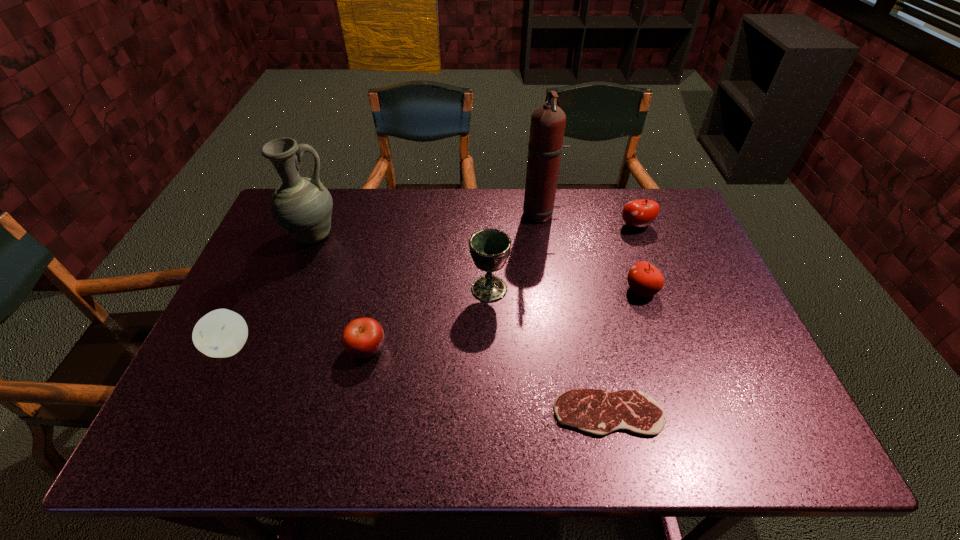
Where is `free point located 0.170m on the side of the tallest object with the label and nozzle`? This screenshot has width=960, height=540. free point located 0.170m on the side of the tallest object with the label and nozzle is located at coordinates (471, 215).

Find the location of `vacant space located 0.120m on the side of the tallest object with the label and nozzle`. vacant space located 0.120m on the side of the tallest object with the label and nozzle is located at coordinates (486, 215).

Image resolution: width=960 pixels, height=540 pixels. In order to click on free space located on the side of the tallest object with the label and nozzle in this screenshot , I will do `click(498, 215)`.

Where is `vacant space located on the handle side of the second tallest object`? vacant space located on the handle side of the second tallest object is located at coordinates (386, 236).

Locate an element on the screen. The image size is (960, 540). vacant space positioned 0.290m on the front of the chalice is located at coordinates (492, 402).

In order to click on vacant space located on the left of the farthest apple in this screenshot , I will do `click(546, 226)`.

The width and height of the screenshot is (960, 540). I want to click on vacant space located on the back of the leftmost apple, so click(276, 250).

At what (x,y) coordinates should I click in order to perform the action: click on vacant space located on the back of the third nearest apple. Please return your answer as a coordinate pair (x, y). The height and width of the screenshot is (540, 960). Looking at the image, I should click on (612, 205).

The image size is (960, 540). Identify the location of vacant space situated on the right of the second apple from left to right. (549, 348).

Find the location of a particular element. free spot located on the right of the shortest object is located at coordinates (741, 413).